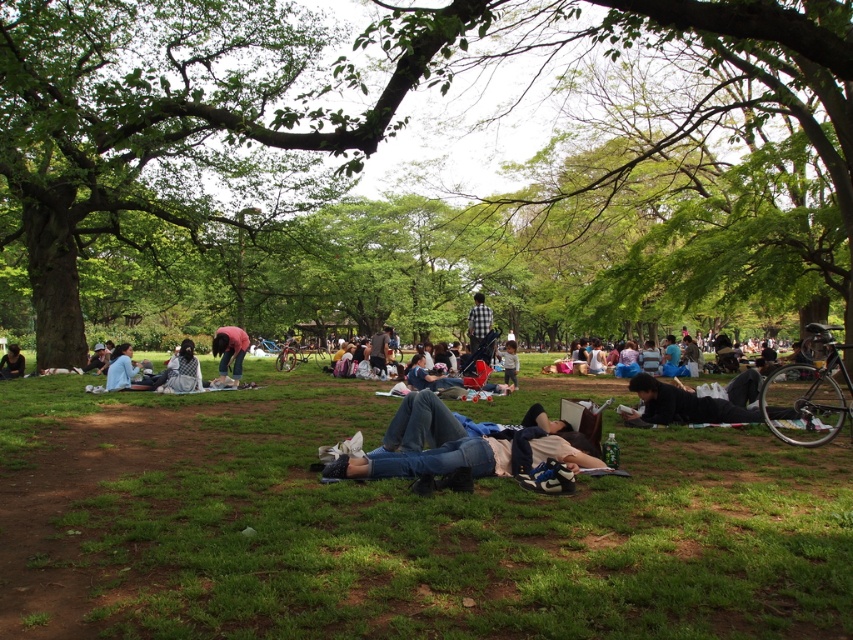
Is denim jeans at center further to the viewer compared to matte black jacket at lower left?

No, it is in front of matte black jacket at lower left.

The height and width of the screenshot is (640, 853). What are the coordinates of `denim jeans at center` in the screenshot? It's located at (469, 451).

Does point (555, 480) lie behind point (12, 356)?

No, it is not.

This screenshot has height=640, width=853. I want to click on denim jeans at center, so click(x=469, y=451).

Is checkered fabric shirt at center further to the viewer compared to light brown fabric jacket at center?

No, checkered fabric shirt at center is closer to the viewer.

What do you see at coordinates (479, 321) in the screenshot? The image size is (853, 640). I see `checkered fabric shirt at center` at bounding box center [479, 321].

Where is `checkered fabric shirt at center`? checkered fabric shirt at center is located at coordinates (479, 321).

Locate an element on the screen. Image resolution: width=853 pixels, height=640 pixels. matte black jacket at lower left is located at coordinates (10, 362).

The width and height of the screenshot is (853, 640). Find the location of `matte black jacket at lower left`. matte black jacket at lower left is located at coordinates (10, 362).